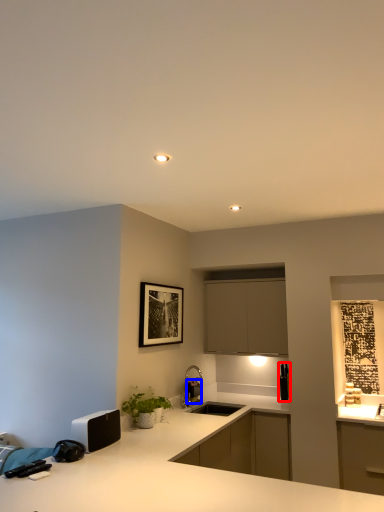
Question: Which point is closer to the camera, appliance (highlighted by a red box) or appliance (highlighted by a blue box)?

Choices:
 (A) appliance
 (B) appliance

Answer: (B)